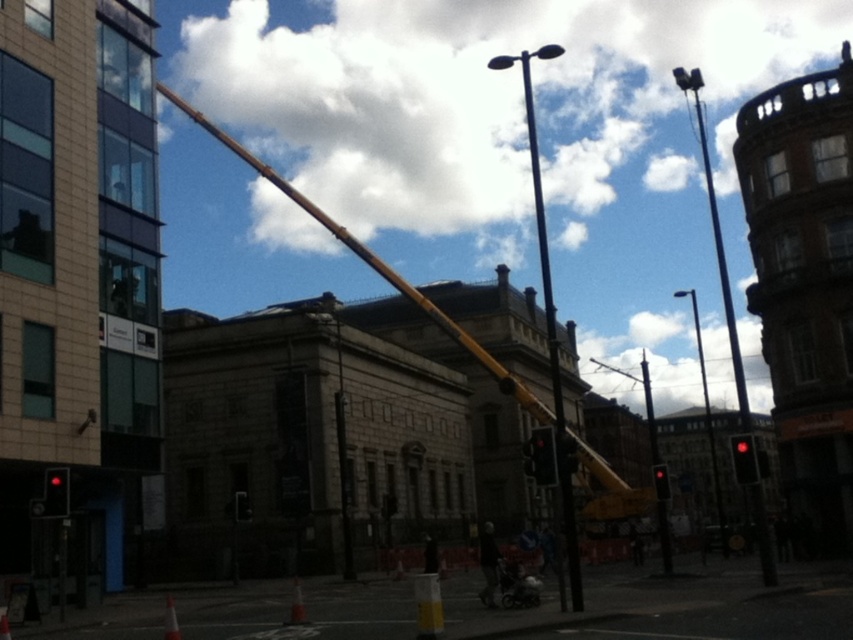
You are a city planner evaluating the urban space. You notice the polished metal street light at center and the orange traffic cone at lower left. Which object would cast a longer shadow during midday when the sun is directly overhead?

The polished metal street light at center is bigger than the orange traffic cone at lower left, so it would cast a longer shadow during midday when the sun is directly overhead.